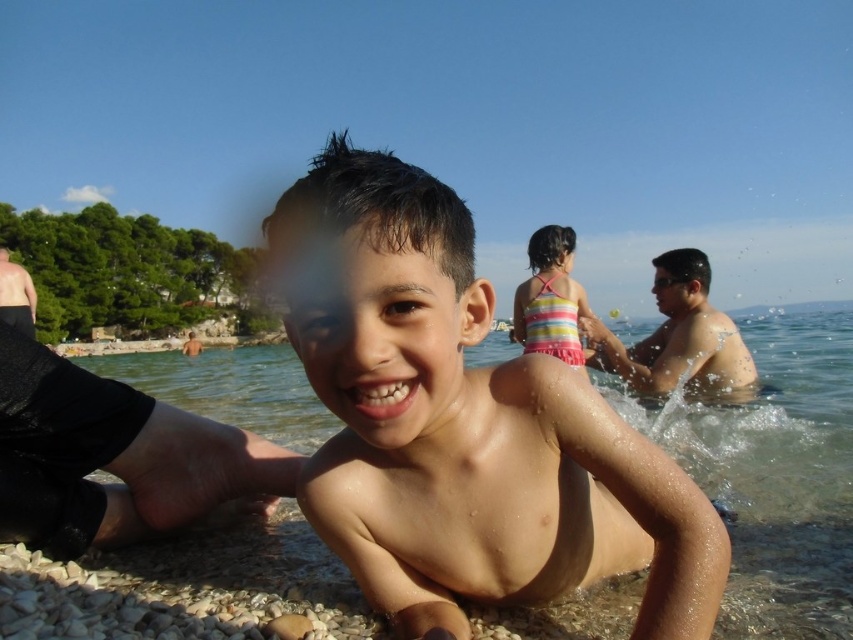
You are a GUI agent. You are given a task and a screenshot of the screen. Output one action in this format:
    pyautogui.click(x=<x>, y=<y>)
    Task: Click on the smooth skin boy at center
    The height and width of the screenshot is (640, 853).
    Given the screenshot: What is the action you would take?
    pyautogui.click(x=677, y=337)

Between smooth skin boy at center and striped fabric swimsuit at center, which one appears on the right side from the viewer's perspective?

From the viewer's perspective, smooth skin boy at center appears more on the right side.

Is point (599, 330) more distant than point (569, 298)?

No, it is not.

The width and height of the screenshot is (853, 640). I want to click on smooth skin boy at center, so click(677, 337).

Does point (675, 422) come closer to viewer compared to point (563, 257)?

Yes, point (675, 422) is closer to viewer.

What are the coordinates of `clear water at boy front` in the screenshot? It's located at (775, 472).

From the picture: Can you confirm if wet skin boy at center is shorter than clear water at boy front?

Correct, wet skin boy at center is not as tall as clear water at boy front.

Is wet skin boy at center behind clear water at boy front?

No, it is not.

Is point (660, 458) positioned before point (73, 572)?

Yes, it is.

Find the location of a particular element. Image resolution: width=853 pixels, height=640 pixels. wet skin boy at center is located at coordinates (463, 422).